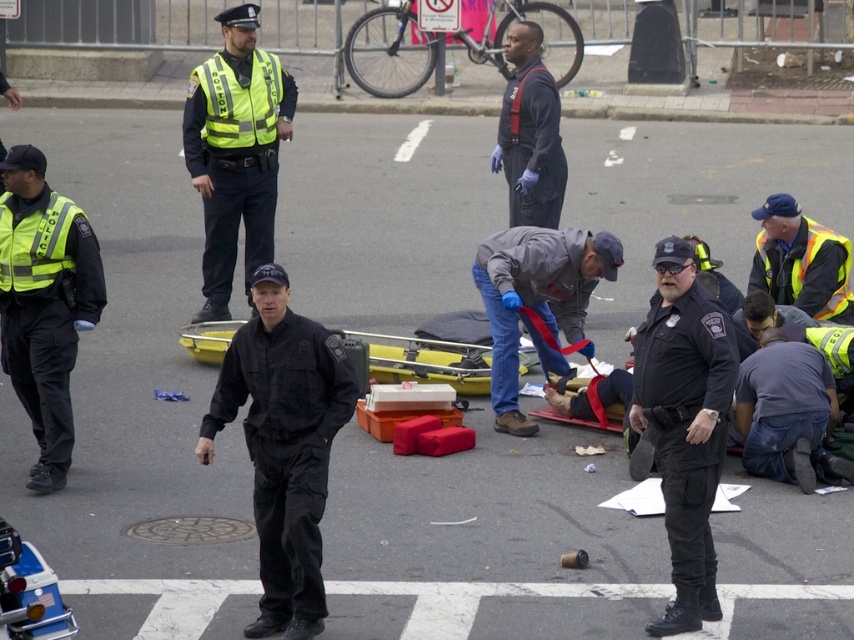
In the scene shown: Which of these two, reflective yellow vest at left or reflective yellow vest at upper left, stands shorter?

reflective yellow vest at left

What do you see at coordinates (44, 304) in the screenshot? I see `reflective yellow vest at left` at bounding box center [44, 304].

Identify the location of reflective yellow vest at left. This screenshot has width=854, height=640. coord(44,304).

Based on the photo, does reflective yellow vest at left have a greater height compared to gray fabric jacket at center?

Indeed, reflective yellow vest at left has a greater height compared to gray fabric jacket at center.

From the picture: Can you confirm if reflective yellow vest at left is smaller than gray fabric jacket at center?

Correct, reflective yellow vest at left occupies less space than gray fabric jacket at center.

Find the location of a particular element. The image size is (854, 640). reflective yellow vest at left is located at coordinates (44, 304).

Which of these two, black uniform at center or dark blue jeans at lower right, stands shorter?

dark blue jeans at lower right

Does black uniform at center appear on the right side of dark blue jeans at lower right?

Incorrect, black uniform at center is not on the right side of dark blue jeans at lower right.

Is point (265, 586) positioned after point (787, 481)?

No, it is in front of (787, 481).

Find the location of a particular element. This screenshot has height=640, width=854. black uniform at center is located at coordinates (284, 445).